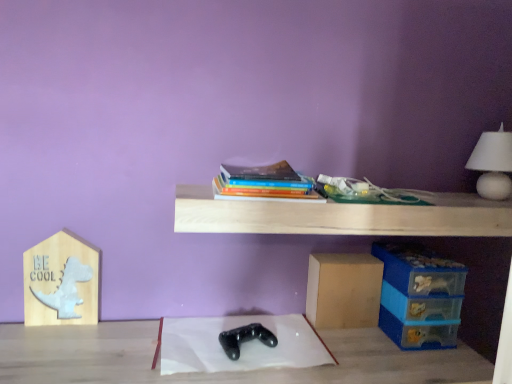
Question: Is light wood shelf at upper center positioned in front of white matte table lamp at upper right?

Choices:
 (A) no
 (B) yes

Answer: (B)

Question: Are light wood shelf at upper center and white matte table lamp at upper right located far from each other?

Choices:
 (A) yes
 (B) no

Answer: (B)

Question: Can you confirm if light wood shelf at upper center is bigger than white matte table lamp at upper right?

Choices:
 (A) no
 (B) yes

Answer: (B)

Question: Is light wood shelf at upper center looking in the opposite direction of white matte table lamp at upper right?

Choices:
 (A) yes
 (B) no

Answer: (B)

Question: Can you confirm if light wood shelf at upper center is thinner than white matte table lamp at upper right?

Choices:
 (A) yes
 (B) no

Answer: (B)

Question: Choose the correct answer: Is light wood shelf at upper center inside white paper at center or outside it?

Choices:
 (A) outside
 (B) inside

Answer: (A)

Question: Does point (206, 226) appear closer or farther from the camera than point (317, 362)?

Choices:
 (A) farther
 (B) closer

Answer: (B)

Question: In terms of width, does light wood shelf at upper center look wider or thinner when compared to white paper at center?

Choices:
 (A) wide
 (B) thin

Answer: (B)

Question: In terms of height, does light wood shelf at upper center look taller or shorter compared to white paper at center?

Choices:
 (A) tall
 (B) short

Answer: (A)

Question: Is white matte table lamp at upper right wider or thinner than white paper at center?

Choices:
 (A) thin
 (B) wide

Answer: (A)

Question: Is white matte table lamp at upper right taller or shorter than white paper at center?

Choices:
 (A) short
 (B) tall

Answer: (B)

Question: From the image's perspective, is white matte table lamp at upper right located above or below white paper at center?

Choices:
 (A) above
 (B) below

Answer: (A)

Question: Is white matte table lamp at upper right spatially inside white paper at center, or outside of it?

Choices:
 (A) inside
 (B) outside

Answer: (B)

Question: From a real-world perspective, is white paper at center above or below white matte table lamp at upper right?

Choices:
 (A) below
 (B) above

Answer: (A)

Question: In the image, is white paper at center on the left side or the right side of white matte table lamp at upper right?

Choices:
 (A) left
 (B) right

Answer: (A)